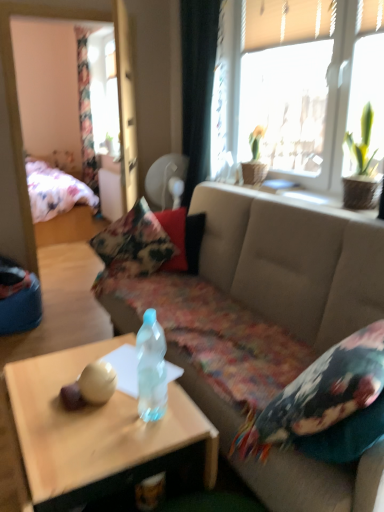
Measure the distance between point [186,44] and camera.

3.18 meters.

In order to click on black fabric curtain at upper center, which appears as the 2th curtain when viewed from the back in this screenshot , I will do coord(197,86).

This screenshot has width=384, height=512. Describe the element at coordinates (325, 404) in the screenshot. I see `floral fabric pillow at right, which ranks as the 1th pillow in front-to-back order` at that location.

Image resolution: width=384 pixels, height=512 pixels. Find the location of `green leafy plant in woven basket at upper right, which is counted as the 1th houseplant, starting from the right`. green leafy plant in woven basket at upper right, which is counted as the 1th houseplant, starting from the right is located at coordinates (361, 167).

Describe the element at coordinates (361, 167) in the screenshot. I see `green leafy plant in woven basket at upper right, which is counted as the 1th houseplant, starting from the front` at that location.

This screenshot has width=384, height=512. I want to click on green woven basket at upper right, the first houseplant when ordered from back to front, so click(255, 159).

What is the approximate width of green woven basket at upper right, the second houseplant viewed from the right?

green woven basket at upper right, the second houseplant viewed from the right, is 8.88 inches wide.

This screenshot has width=384, height=512. Find the location of `black fabric curtain at upper center, which is the first curtain in right-to-left order`. black fabric curtain at upper center, which is the first curtain in right-to-left order is located at coordinates (197, 86).

Is green woven basket at upper right, the first houseplant when ordered from back to front, in front of translucent plastic bottle at center?

No, green woven basket at upper right, the first houseplant when ordered from back to front, is further to the viewer.

Is green woven basket at upper right, the 2th houseplant viewed from the front, beside translucent plastic bottle at center?

No, green woven basket at upper right, the 2th houseplant viewed from the front, is not in contact with translucent plastic bottle at center.

From a real-world perspective, which object rests below the other?

In real-world perspective, translucent plastic bottle at center is lower.

Is green woven basket at upper right, the first houseplant when ordered from back to front, bigger or smaller than translucent plastic bottle at center?

In the image, green woven basket at upper right, the first houseplant when ordered from back to front, appears to be larger than translucent plastic bottle at center.

Are green leafy plant in woven basket at upper right, which is counted as the 1th houseplant, starting from the right, and translucent plastic coffee table at center making contact?

There is a gap between green leafy plant in woven basket at upper right, which is counted as the 1th houseplant, starting from the right, and translucent plastic coffee table at center.

Is green leafy plant in woven basket at upper right, the 2th houseplant from the back, to the right of translucent plastic coffee table at center from the viewer's perspective?

Yes, green leafy plant in woven basket at upper right, the 2th houseplant from the back, is to the right of translucent plastic coffee table at center.

Which object is closer to the camera, green leafy plant in woven basket at upper right, which is the second houseplant from left to right, or translucent plastic coffee table at center?

translucent plastic coffee table at center is in front.

How much distance is there between green leafy plant in woven basket at upper right, which is the second houseplant from left to right, and translucent plastic coffee table at center?

The distance of green leafy plant in woven basket at upper right, which is the second houseplant from left to right, from translucent plastic coffee table at center is 1.52 meters.

Can you confirm if beige fabric couch at center is wider than green leafy plant in woven basket at upper right, which is counted as the 1th houseplant, starting from the right?

Yes.

Which object is closer to the camera taking this photo, beige fabric couch at center or green leafy plant in woven basket at upper right, which is the second houseplant from left to right?

beige fabric couch at center is closer to the camera.

Considering the positions of points (322, 341) and (350, 137), is point (322, 341) farther from camera compared to point (350, 137)?

No, it is not.

Is beige fabric couch at center not near green leafy plant in woven basket at upper right, which is the second houseplant from left to right?

No, beige fabric couch at center is in close proximity to green leafy plant in woven basket at upper right, which is the second houseplant from left to right.

Can you confirm if translucent plastic bottle at center is bigger than floral fabric pillow at center, positioned as the 1th pillow in left-to-right order?

No, translucent plastic bottle at center is not bigger than floral fabric pillow at center, positioned as the 1th pillow in left-to-right order.

From a real-world perspective, who is located lower, translucent plastic bottle at center or floral fabric pillow at center, positioned as the 1th pillow in left-to-right order?

floral fabric pillow at center, positioned as the 1th pillow in left-to-right order, is physically lower.

Is translucent plastic bottle at center next to floral fabric pillow at center, positioned as the second pillow in front-to-back order, and touching it?

translucent plastic bottle at center and floral fabric pillow at center, positioned as the second pillow in front-to-back order, are clearly separated.

Looking at this image, from the image's perspective, does green leafy plant in woven basket at upper right, the 2th houseplant from the back, appear higher than black fabric curtain at upper center, the second curtain viewed from the left?

No.

Is green leafy plant in woven basket at upper right, which is the second houseplant from left to right, closer to the viewer compared to black fabric curtain at upper center, the second curtain viewed from the left?

Yes, green leafy plant in woven basket at upper right, which is the second houseplant from left to right, is in front of black fabric curtain at upper center, the second curtain viewed from the left.

Is green leafy plant in woven basket at upper right, the 2th houseplant from the back, outside of black fabric curtain at upper center, which appears as the 2th curtain when viewed from the back?

Absolutely, green leafy plant in woven basket at upper right, the 2th houseplant from the back, is external to black fabric curtain at upper center, which appears as the 2th curtain when viewed from the back.

Which of these two, green leafy plant in woven basket at upper right, which is counted as the 1th houseplant, starting from the right, or black fabric curtain at upper center, the second curtain viewed from the left, is thinner?

black fabric curtain at upper center, the second curtain viewed from the left, is thinner.

From a real-world perspective, is translucent plastic coffee table at center physically below floral fabric pillow at center, which ranks as the 2th pillow in right-to-left order?

Correct, in the physical world, translucent plastic coffee table at center is lower than floral fabric pillow at center, which ranks as the 2th pillow in right-to-left order.

Is translucent plastic coffee table at center far away from floral fabric pillow at center, positioned as the 1th pillow in left-to-right order?

Indeed, translucent plastic coffee table at center is not near floral fabric pillow at center, positioned as the 1th pillow in left-to-right order.

From the image's perspective, is translucent plastic coffee table at center beneath floral fabric pillow at center, positioned as the 1th pillow in left-to-right order?

Correct, translucent plastic coffee table at center appears lower than floral fabric pillow at center, positioned as the 1th pillow in left-to-right order, in the image.

Who is smaller, translucent plastic coffee table at center or floral fabric pillow at center, which ranks as the 2th pillow in right-to-left order?

Smaller between the two is floral fabric pillow at center, which ranks as the 2th pillow in right-to-left order.

Is black fabric curtain at upper center, the second curtain viewed from the left, next to green woven basket at upper right, the 2th houseplant viewed from the front?

black fabric curtain at upper center, the second curtain viewed from the left, and green woven basket at upper right, the 2th houseplant viewed from the front, are clearly separated.

From a real-world perspective, starting from the green woven basket at upper right, which appears as the 1th houseplant when viewed from the left, which curtain is the 2nd one vertically above it? Please provide its 2D coordinates.

[(197, 86)]

Can you confirm if black fabric curtain at upper center, the second curtain viewed from the left, is positioned to the left of green woven basket at upper right, the second houseplant viewed from the right?

Yes, black fabric curtain at upper center, the second curtain viewed from the left, is to the left of green woven basket at upper right, the second houseplant viewed from the right.

You are a GUI agent. You are given a task and a screenshot of the screen. Output one action in this format:
    pyautogui.click(x=<x>, y=<y>)
    Task: Click on the bottle below the green woven basket at upper right, which appears as the 1th houseplant when viewed from the left (from a real-world perspective)
    
    Given the screenshot: What is the action you would take?
    pyautogui.click(x=151, y=368)

This screenshot has height=512, width=384. Identify the location of coffee table on the left of green leafy plant in woven basket at upper right, which is counted as the 1th houseplant, starting from the front. (93, 433).

Estimate the real-world distances between objects in this image. Which object is closer to green woven basket at upper right, the 2th houseplant viewed from the front, translucent plastic coffee table at center or translucent plastic bottle at center?

Based on the image, translucent plastic bottle at center appears to be nearer to green woven basket at upper right, the 2th houseplant viewed from the front.

Estimate the real-world distances between objects in this image. Which object is closer to floral fabric pillow at center, marked as the 1th pillow in a back-to-front arrangement, floral fabric bed at left or beige fabric couch at center?

Among the two, beige fabric couch at center is located nearer to floral fabric pillow at center, marked as the 1th pillow in a back-to-front arrangement.

From the image, which object appears to be farther from green woven basket at upper right, the 2th houseplant viewed from the front, beige fabric couch at center or translucent plastic bottle at center?

Among the two, translucent plastic bottle at center is located further to green woven basket at upper right, the 2th houseplant viewed from the front.

Considering their positions, is floral fabric bed at left positioned further to green woven basket at upper right, the 2th houseplant viewed from the front, than green leafy plant in woven basket at upper right, which is the second houseplant from left to right?

The object further to green woven basket at upper right, the 2th houseplant viewed from the front, is floral fabric bed at left.

Looking at the image, which one is located further to floral fabric bed at left, beige fabric couch at center or translucent plastic coffee table at center?

The object further to floral fabric bed at left is translucent plastic coffee table at center.

Which object lies further to the anchor point black fabric curtain at upper center, which is the first curtain in right-to-left order, floral fabric curtain at left, the 2th curtain from the right, or green leafy plant in woven basket at upper right, which is counted as the 1th houseplant, starting from the front?

floral fabric curtain at left, the 2th curtain from the right, is positioned further to the anchor black fabric curtain at upper center, which is the first curtain in right-to-left order.

From the image, which object appears to be farther from beige fabric couch at center, floral fabric curtain at left, arranged as the 1th curtain when viewed from the back, or translucent glass window at upper right?

The object further to beige fabric couch at center is floral fabric curtain at left, arranged as the 1th curtain when viewed from the back.

Looking at the image, which one is located further to translucent glass window at upper right, floral fabric bed at left or translucent plastic bottle at center?

Based on the image, floral fabric bed at left appears to be further to translucent glass window at upper right.

Locate an element on the screen. window between translucent plastic coffee table at center and green woven basket at upper right, the 2th houseplant viewed from the front, from front to back is located at coordinates (286, 85).

The width and height of the screenshot is (384, 512). I want to click on curtain positioned between translucent plastic coffee table at center and floral fabric curtain at left, the second curtain positioned from the front, from near to far, so pyautogui.click(x=197, y=86).

The image size is (384, 512). Identify the location of coffee table positioned between floral fabric pillow at right, marked as the 2th pillow in a back-to-front arrangement, and floral fabric pillow at center, positioned as the second pillow in front-to-back order, from near to far. (93, 433).

The height and width of the screenshot is (512, 384). What are the coordinates of `curtain between floral fabric pillow at right, which ranks as the 1th pillow in front-to-back order, and floral fabric bed at left in the front-back direction` in the screenshot? It's located at (197, 86).